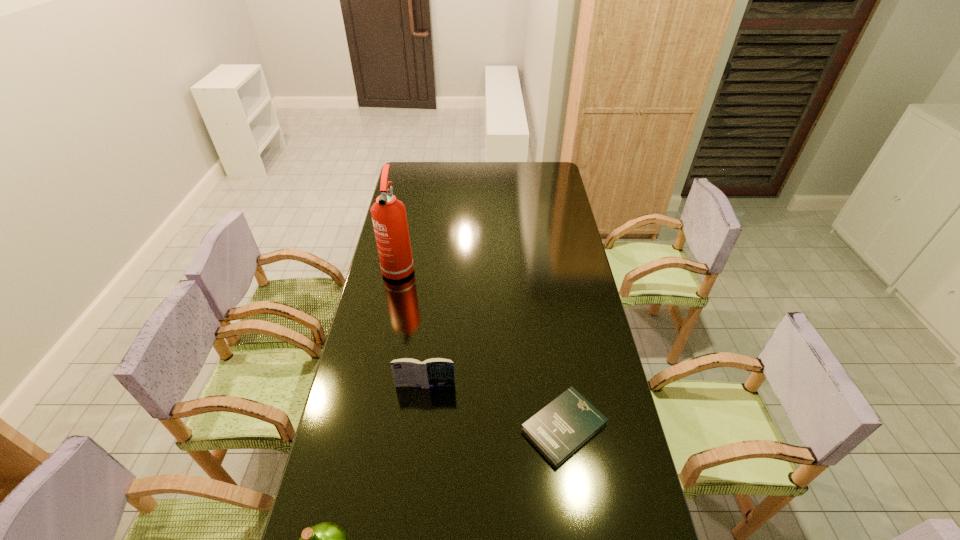
This screenshot has height=540, width=960. Identify the location of book at the left edge. (432, 372).

What are the coordinates of `object that is positioned at the right edge` in the screenshot? It's located at pos(563,426).

Locate an element on the screen. The image size is (960, 540). vacant space at the far edge is located at coordinates (449, 180).

Identify the location of vacant region at the left edge of the desktop. (365, 362).

I want to click on free space at the right edge, so click(547, 190).

Locate an element on the screen. The width and height of the screenshot is (960, 540). free space between the right book and the second shortest object is located at coordinates (494, 406).

Identify the location of free area in between the second farthest object and the tallest object. This screenshot has width=960, height=540. (412, 326).

Where is `empty location between the taller book and the tallest object`? The image size is (960, 540). empty location between the taller book and the tallest object is located at coordinates (412, 326).

Identify the location of free space between the taller book and the nearer book. (494, 406).

Image resolution: width=960 pixels, height=540 pixels. What are the coordinates of `free space that is in between the third object from left to right and the farthest object` in the screenshot? It's located at (412, 326).